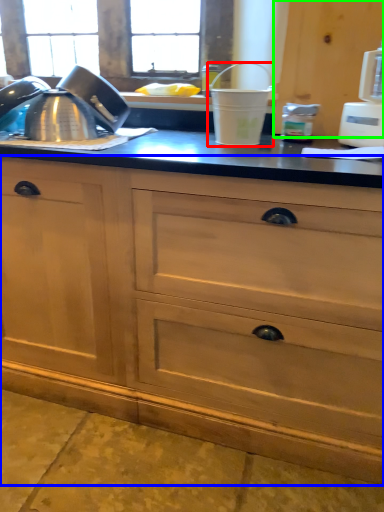
Question: Which is farther away from appliance (highlighted by a red box)? cabinetry (highlighted by a blue box) or cabinetry (highlighted by a green box)?

Choices:
 (A) cabinetry
 (B) cabinetry

Answer: (A)